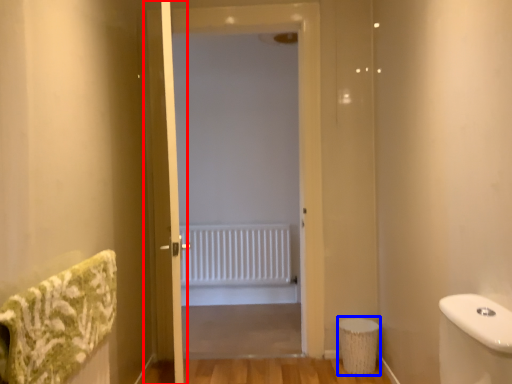
Question: Which object is closer to the camera taking this photo, screen door (highlighted by a red box) or toilet bowl (highlighted by a blue box)?

Choices:
 (A) screen door
 (B) toilet bowl

Answer: (A)